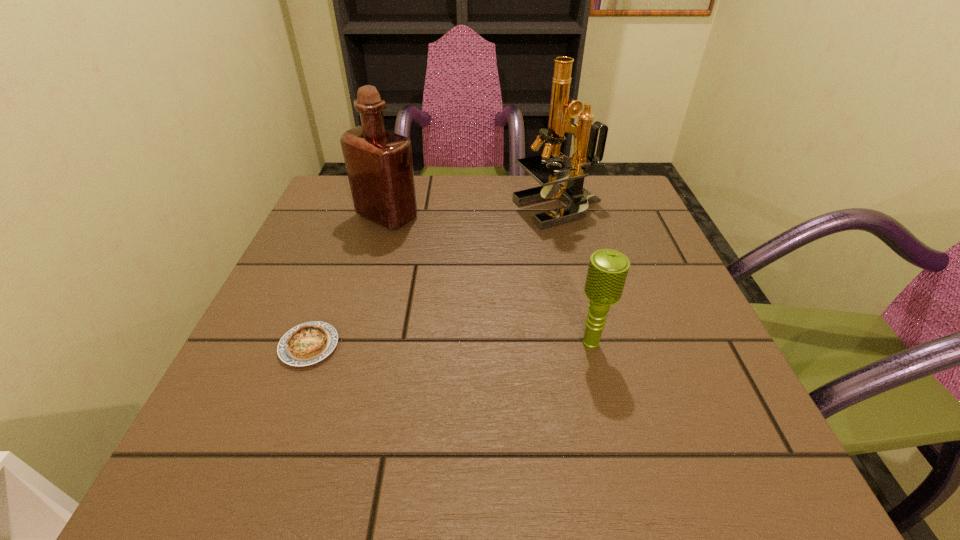
What are the coordinates of `microscope` in the screenshot? It's located at (562, 108).

What are the coordinates of `the second tallest object` in the screenshot? It's located at (379, 164).

The height and width of the screenshot is (540, 960). I want to click on microphone, so click(x=607, y=272).

I want to click on quiche, so click(x=308, y=343).

At what (x,y) coordinates should I click in order to perform the action: click on vacant space located 0.290m at the eyepiece of the microscope. Please return your answer as a coordinate pair (x, y). This screenshot has height=540, width=960. Looking at the image, I should click on (394, 210).

The width and height of the screenshot is (960, 540). What are the coordinates of `free location located 0.130m at the eyepiece of the microscope` in the screenshot? It's located at (460, 210).

Where is `free space located 0.390m at the eyepiece of the microscope`? Image resolution: width=960 pixels, height=540 pixels. free space located 0.390m at the eyepiece of the microscope is located at coordinates (352, 210).

I want to click on blank space located 0.050m on the front of the liquor, so click(378, 246).

Image resolution: width=960 pixels, height=540 pixels. Find the location of `vacant space located 0.150m on the front of the second shortest object`. vacant space located 0.150m on the front of the second shortest object is located at coordinates coord(615,443).

I want to click on free region located 0.060m on the front of the shortest object, so click(288, 402).